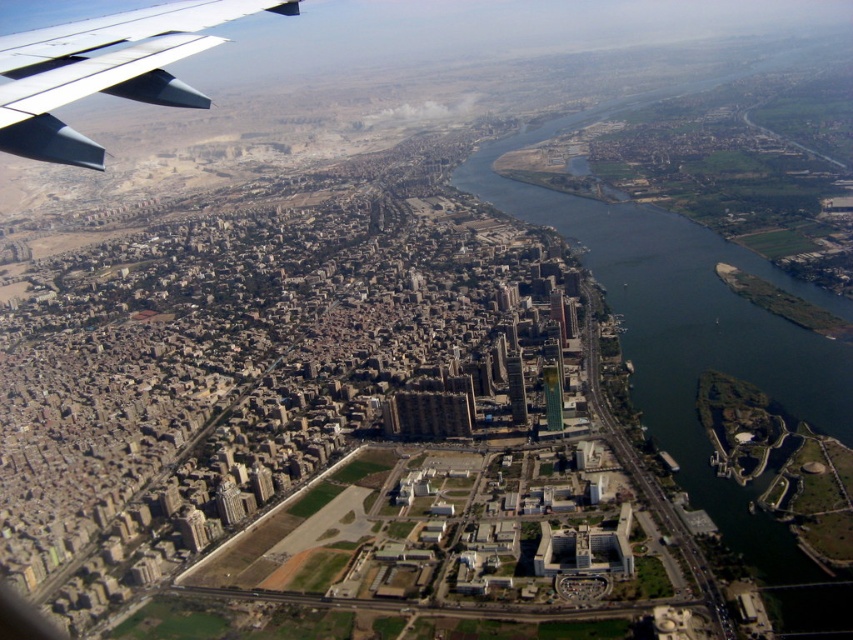
Based on the photo, you are a drone operator who needs to deliver a package to a location 2000 feet away from you. Your drone has a maximum range of 2000 feet. Based on the scene, can the green water at center right be used as a landmark to confirm the delivery location is within range?

The green water at center right is 2072.36 feet away from the viewer, which exceeds the drone operator s maximum range of 2000 feet. Therefore, the delivery location may be beyond the drone s capability.

You are a pilot flying a small plane and notice the green water at center right and the metallic gray wing at upper left in your view. Which object is closer to your current position?

The green water at center right is closer to your current position because the metallic gray wing at upper left is behind it.